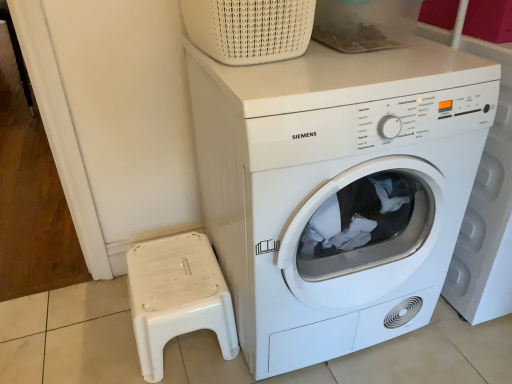
Question: From the image's perspective, relative to white woven basket at upper center, is white matte washing machine at center above or below?

Choices:
 (A) below
 (B) above

Answer: (A)

Question: Would you say white matte washing machine at center is to the left or to the right of white woven basket at upper center in the picture?

Choices:
 (A) left
 (B) right

Answer: (B)

Question: Which object is the closest to the white plastic stool at lower left?

Choices:
 (A) white woven basket at upper center
 (B) white matte washing machine at center

Answer: (B)

Question: Considering the real-world distances, which object is closest to the white matte washing machine at center?

Choices:
 (A) white plastic stool at lower left
 (B) white woven basket at upper center

Answer: (B)